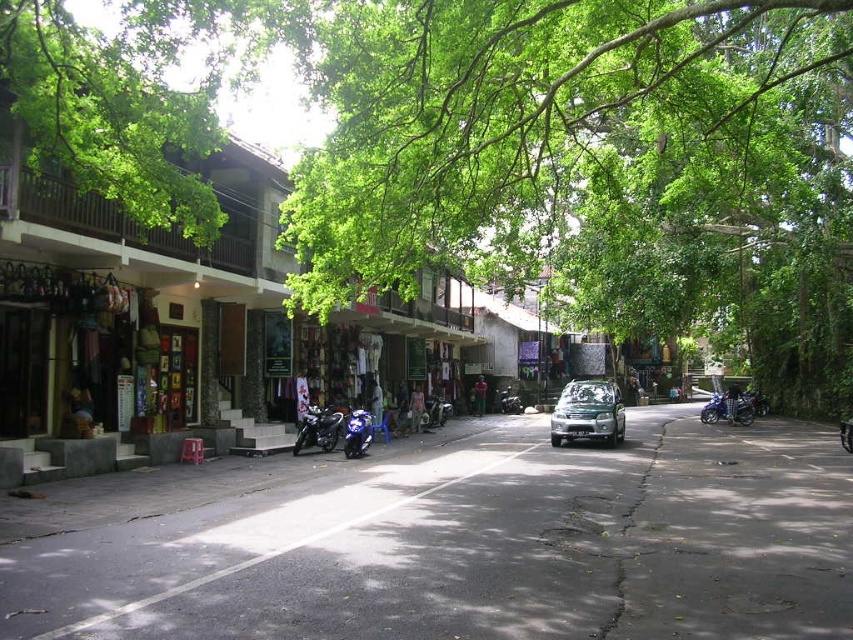
Question: Which object is the farthest from the blue metallic motorcycle at center?

Choices:
 (A) matte stone shop at center
 (B) green fabric person at center
 (C) green leafy tree at center

Answer: (C)

Question: Is green leafy tree at center to the left of denim jacket at center from the viewer's perspective?

Choices:
 (A) yes
 (B) no

Answer: (B)

Question: Which of these objects is positioned closest to the blue metallic motorcycle at center?

Choices:
 (A) green leafy tree at center
 (B) blue metallic motorcycle at right
 (C) metallic silver car at center
 (D) denim jacket at center

Answer: (D)

Question: Where is blue metallic motorcycle at center located in relation to denim jacket at center in the image?

Choices:
 (A) right
 (B) left

Answer: (A)

Question: Which of these objects is positioned farthest from the asphalt road at center?

Choices:
 (A) denim jacket at center
 (B) denim pants at center
 (C) green fabric person at center
 (D) blue metallic motorcycle at right

Answer: (C)

Question: Is metallic silver car at center below blue metallic motorcycle at right?

Choices:
 (A) yes
 (B) no

Answer: (B)